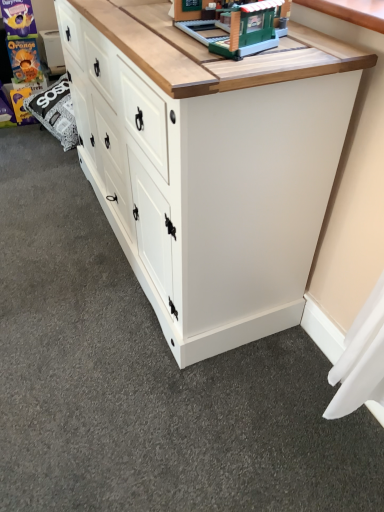
Image resolution: width=384 pixels, height=512 pixels. I want to click on white painted wood chest of drawers at center, so click(210, 167).

Measure the distance between point (262,168) and camera.

Point (262,168) is 93.00 centimeters from camera.

What is the approximate height of white painted wood chest of drawers at center?

32.88 inches.

The image size is (384, 512). What do you see at coordinates (210, 167) in the screenshot? I see `white painted wood chest of drawers at center` at bounding box center [210, 167].

The width and height of the screenshot is (384, 512). What do you see at coordinates (239, 30) in the screenshot? I see `green plastic building at upper center` at bounding box center [239, 30].

Measure the distance between point (256, 45) and camera.

They are 81.80 centimeters apart.

Where is `green plastic building at upper center`? The width and height of the screenshot is (384, 512). green plastic building at upper center is located at coordinates (239, 30).

The height and width of the screenshot is (512, 384). I want to click on white painted wood chest of drawers at center, so click(x=210, y=167).

Which object is positioned more to the right, green plastic building at upper center or white painted wood chest of drawers at center?

green plastic building at upper center is more to the right.

Does green plastic building at upper center lie behind white painted wood chest of drawers at center?

That is True.

Which is behind, point (267, 32) or point (226, 230)?

Point (226, 230)

From the image's perspective, does green plastic building at upper center appear lower than white painted wood chest of drawers at center?

No, from the image's perspective, green plastic building at upper center is not beneath white painted wood chest of drawers at center.

From a real-world perspective, which object stands above the other?

green plastic building at upper center, from a real-world perspective.

In the scene shown: Which of these two, green plastic building at upper center or white painted wood chest of drawers at center, is thinner?

green plastic building at upper center is thinner.

Is green plastic building at upper center taller or shorter than white painted wood chest of drawers at center?

Considering their sizes, green plastic building at upper center has less height than white painted wood chest of drawers at center.

Based on the photo, who is bigger, green plastic building at upper center or white painted wood chest of drawers at center?

Bigger between the two is white painted wood chest of drawers at center.

Is green plastic building at upper center outside of white painted wood chest of drawers at center?

green plastic building at upper center lies outside white painted wood chest of drawers at center's area.

Does green plastic building at upper center touch white painted wood chest of drawers at center?

No, green plastic building at upper center is not in contact with white painted wood chest of drawers at center.

Is green plastic building at upper center oriented towards white painted wood chest of drawers at center?

No, green plastic building at upper center is not facing towards white painted wood chest of drawers at center.

What's the angular difference between green plastic building at upper center and white painted wood chest of drawers at center's facing directions?

3.06 degrees separate the facing orientations of green plastic building at upper center and white painted wood chest of drawers at center.

The image size is (384, 512). Find the location of `toy above the white painted wood chest of drawers at center (from the image's perspective)`. toy above the white painted wood chest of drawers at center (from the image's perspective) is located at coordinates (239, 30).

Can you confirm if white painted wood chest of drawers at center is positioned to the left of green plastic building at upper center?

Yes.

Considering the relative positions of white painted wood chest of drawers at center and green plastic building at upper center in the image provided, is white painted wood chest of drawers at center in front of green plastic building at upper center?

Yes, white painted wood chest of drawers at center is closer to the camera.

Considering the positions of points (238, 136) and (199, 34), is point (238, 136) farther from camera compared to point (199, 34)?

No, it is in front of (199, 34).

In the scene shown: From the image's perspective, is white painted wood chest of drawers at center over green plastic building at upper center?

No, from the image's perspective, white painted wood chest of drawers at center is not on top of green plastic building at upper center.

From a real-world perspective, is white painted wood chest of drawers at center located higher than green plastic building at upper center?

No, from a real-world perspective, white painted wood chest of drawers at center is not above green plastic building at upper center.

Is white painted wood chest of drawers at center wider or thinner than green plastic building at upper center?

Considering their sizes, white painted wood chest of drawers at center looks broader than green plastic building at upper center.

Which of these two, white painted wood chest of drawers at center or green plastic building at upper center, stands shorter?

green plastic building at upper center.

Considering the sizes of objects white painted wood chest of drawers at center and green plastic building at upper center in the image provided, who is bigger, white painted wood chest of drawers at center or green plastic building at upper center?

→ white painted wood chest of drawers at center is bigger.

Can green plastic building at upper center be found inside white painted wood chest of drawers at center?

Definitely not — green plastic building at upper center is not inside white painted wood chest of drawers at center.

Would you say white painted wood chest of drawers at center is a long distance from green plastic building at upper center?

That's not correct — white painted wood chest of drawers at center is a little close to green plastic building at upper center.

Is white painted wood chest of drawers at center facing towards green plastic building at upper center?

No, white painted wood chest of drawers at center is not aimed at green plastic building at upper center.

How far apart are white painted wood chest of drawers at center and green plastic building at upper center?

A distance of 12.26 inches exists between white painted wood chest of drawers at center and green plastic building at upper center.

Locate an element on the screen. This screenshot has width=384, height=512. toy above the white painted wood chest of drawers at center (from a real-world perspective) is located at coordinates click(239, 30).

This screenshot has height=512, width=384. Find the location of `chest of drawers in front of the green plastic building at upper center`. chest of drawers in front of the green plastic building at upper center is located at coordinates (210, 167).

Where is `the chest of drawers below the green plastic building at upper center (from a real-world perspective)`? the chest of drawers below the green plastic building at upper center (from a real-world perspective) is located at coordinates (210, 167).